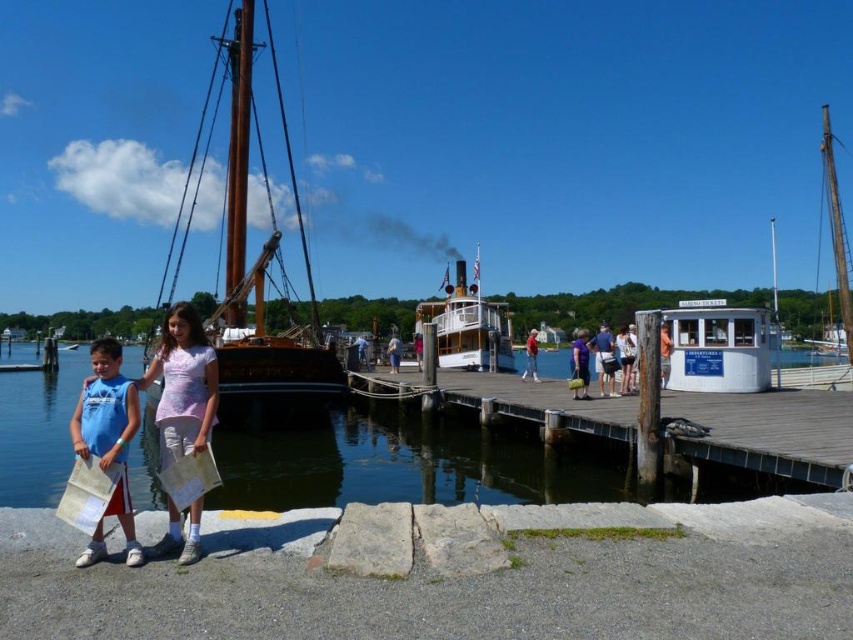
Question: Is wooden sailboat at left positioned at the back of white cotton shirt at center?

Choices:
 (A) yes
 (B) no

Answer: (B)

Question: Which point is closer to the camera?

Choices:
 (A) (607, 340)
 (B) (668, 355)

Answer: (A)

Question: Can you confirm if white cotton shirt at center is positioned to the right of orange fabric shirt at center?

Choices:
 (A) no
 (B) yes

Answer: (B)

Question: Among these objects, which one is nearest to the camera?

Choices:
 (A) white polished wood steamboat at center
 (B) light blue denim shorts at center
 (C) wooden sailboat at left

Answer: (C)

Question: Which of these objects is positioned closest to the blue sleeveless shirt at lower left?

Choices:
 (A) white polished wood steamboat at center
 (B) clear water at lower left

Answer: (B)

Question: Is purple cotton shirt at center above light blue shirt at center?

Choices:
 (A) yes
 (B) no

Answer: (B)